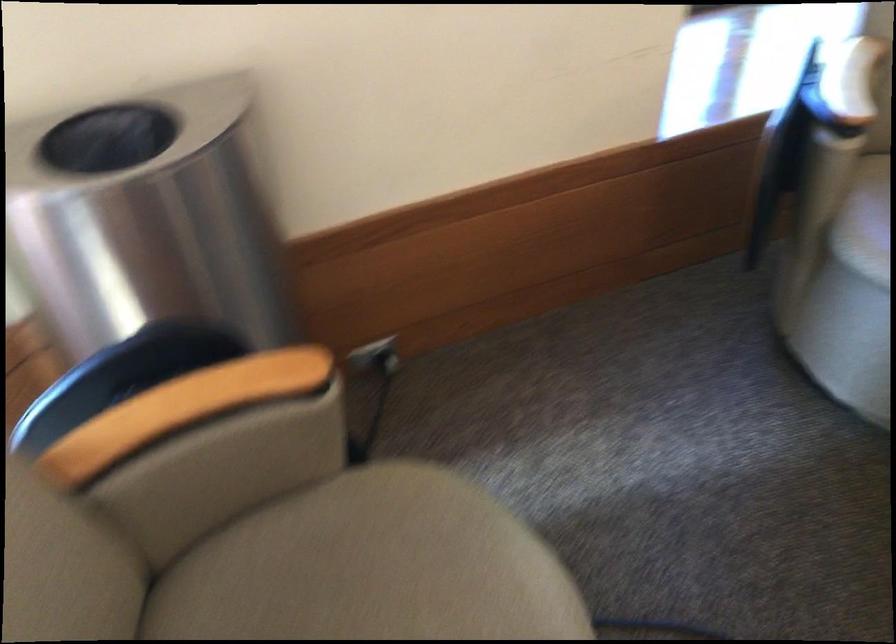
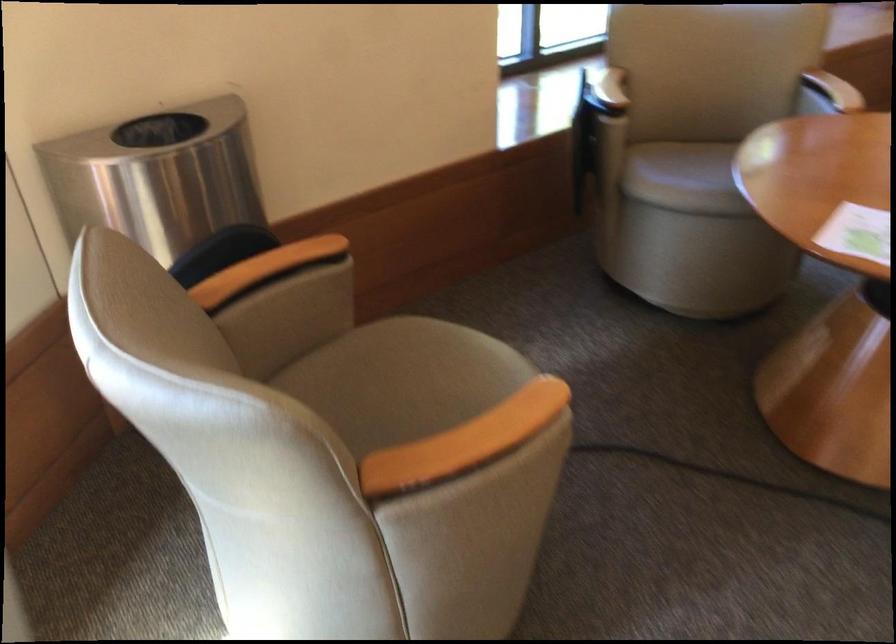
Question: The camera is either moving clockwise (left) or counter-clockwise (right) around the object. The first image is from the beginning of the video and the second image is from the end. Is the camera moving left or right when shooting the video?

Choices:
 (A) Left
 (B) Right

Answer: (A)